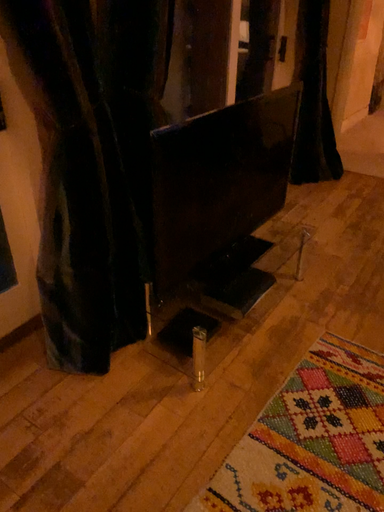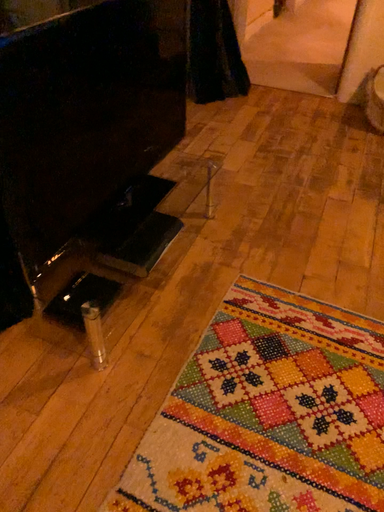
Question: Which way did the camera rotate in the video?

Choices:
 (A) rotated upward
 (B) rotated downward

Answer: (B)